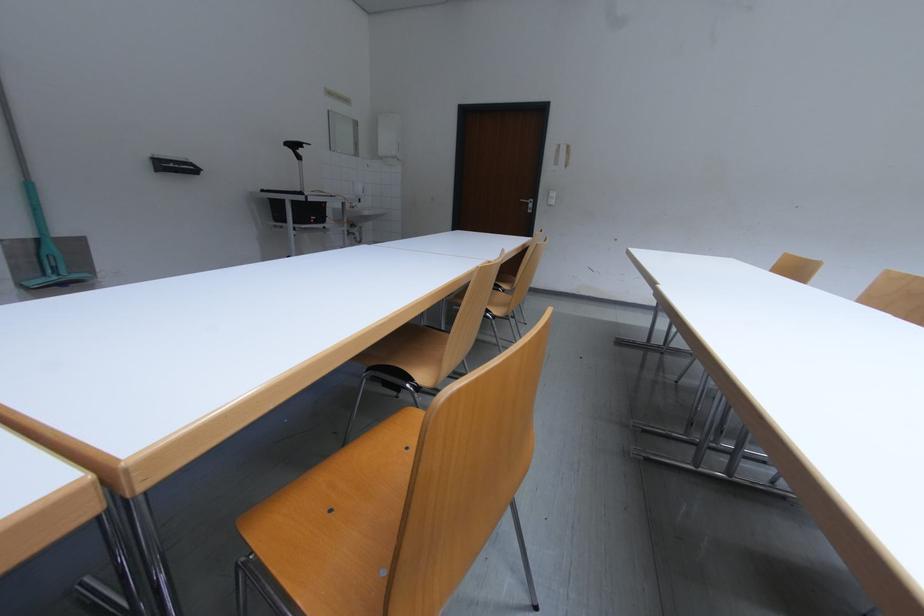
Identify the location of projector head. (295, 147).